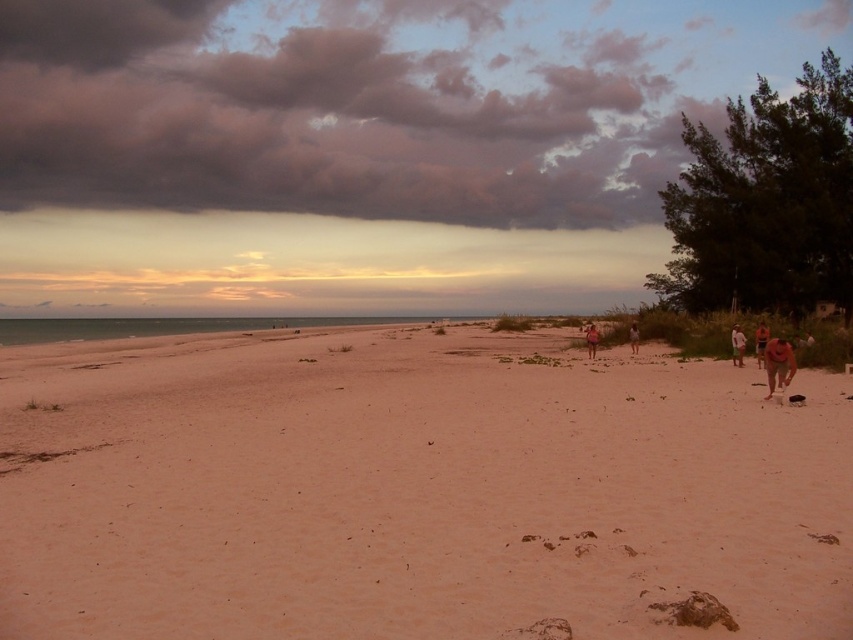
Question: Among these objects, which one is nearest to the camera?

Choices:
 (A) tan skin person at lower right
 (B) tan fabric shorts at right
 (C) dark pink fluffy cloud at upper center
 (D) sandy beach at center

Answer: (D)

Question: Can you confirm if dark pink fluffy cloud at upper center is smaller than tan fabric shorts at center?

Choices:
 (A) yes
 (B) no

Answer: (B)

Question: Does sandy beach at center have a greater width compared to dark pink fluffy cloud at upper center?

Choices:
 (A) yes
 (B) no

Answer: (B)

Question: Which point is farther to the camera?

Choices:
 (A) tan fabric shorts at center
 (B) green fabric shorts at right
 (C) dark pink fluffy cloud at upper center
 (D) pink fabric person at center

Answer: (C)

Question: Does green fabric shorts at right appear on the left side of pink fabric person at center?

Choices:
 (A) yes
 (B) no

Answer: (A)

Question: Which point is farther from the camera taking this photo?

Choices:
 (A) click(x=759, y=355)
 (B) click(x=222, y=177)
 (C) click(x=630, y=344)
 (D) click(x=595, y=330)

Answer: (B)